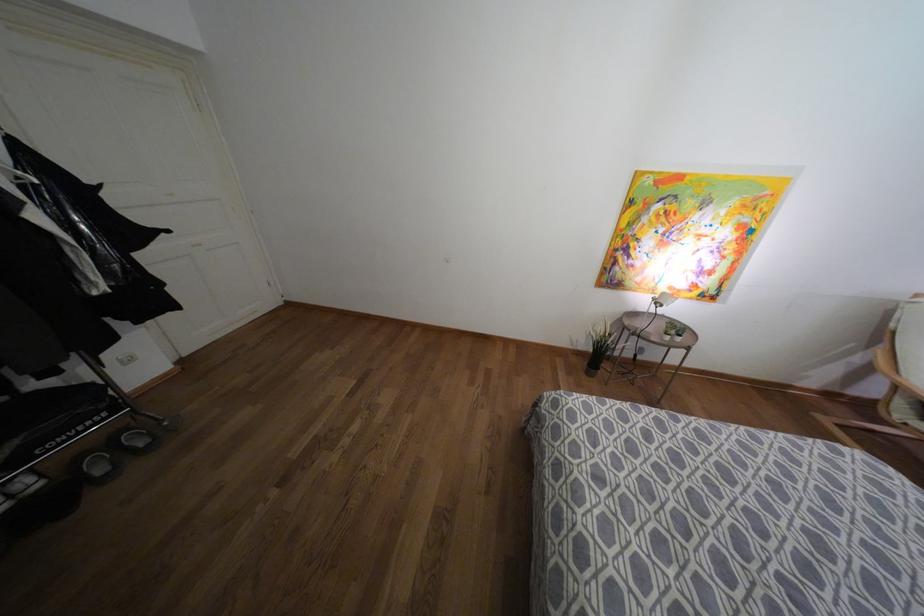
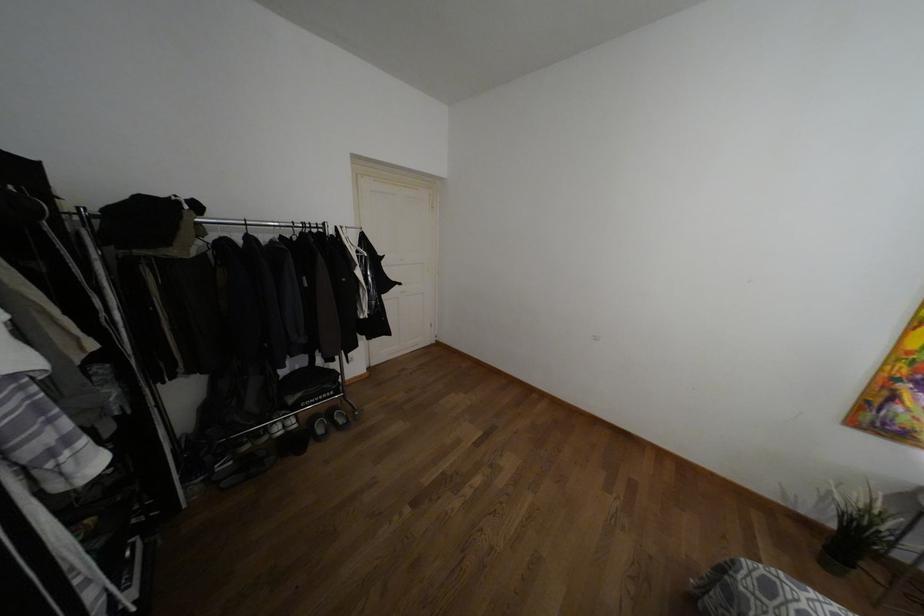
Find the pixel in the second image that matches pixel 160 424 in the first image.

(353, 411)